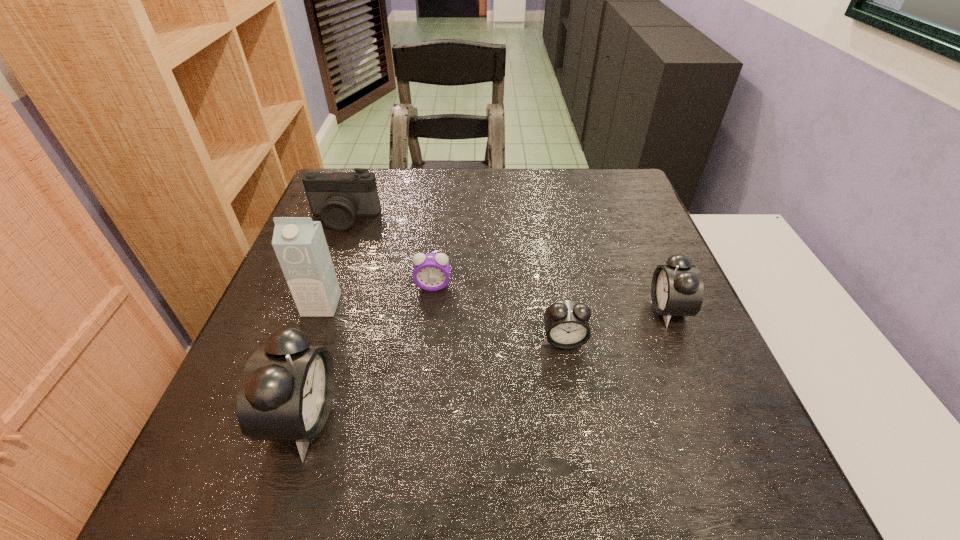
Where is `the leftmost alarm clock`? The width and height of the screenshot is (960, 540). the leftmost alarm clock is located at coordinates (286, 390).

I want to click on the nearest object, so click(x=286, y=390).

The width and height of the screenshot is (960, 540). What are the coordinates of `the fifth farthest object` in the screenshot? It's located at (566, 322).

This screenshot has width=960, height=540. In order to click on the second nearest alarm clock in this screenshot , I will do `click(566, 322)`.

The width and height of the screenshot is (960, 540). Identify the location of the rightmost object. (677, 289).

Find the location of `the rightmost alarm clock`. the rightmost alarm clock is located at coordinates (677, 289).

This screenshot has height=540, width=960. Identify the location of the tallest object. (299, 243).

This screenshot has height=540, width=960. I want to click on camera, so click(x=338, y=197).

Find the location of a particular element. the third object from right to left is located at coordinates (431, 272).

At what (x,y) coordinates should I click in order to perform the action: click on vacant region located on the front side of the nearest object. Please return your answer as a coordinate pair (x, y). Image resolution: width=960 pixels, height=540 pixels. Looking at the image, I should click on pyautogui.click(x=538, y=419).